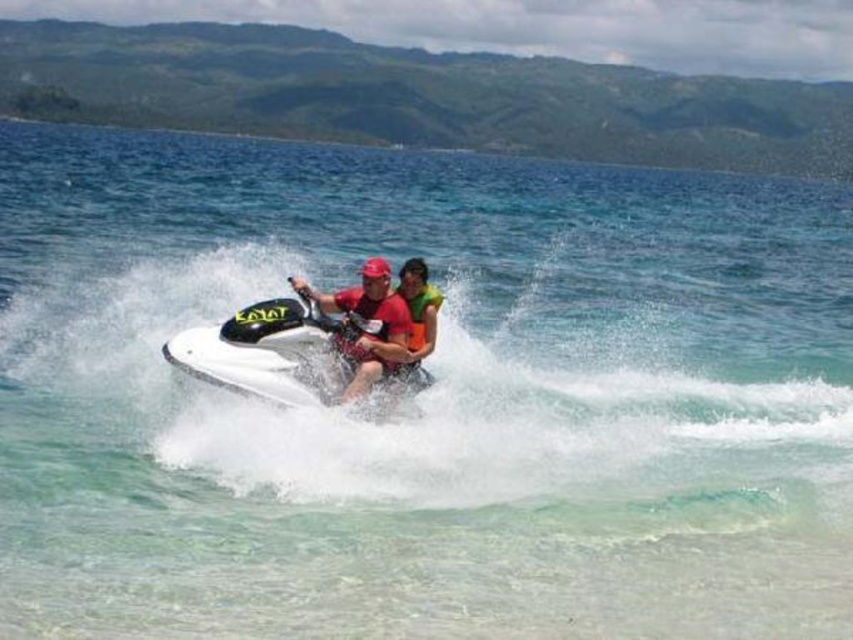
Which of these two, matte red shirt at center or green fabric life jacket at center, stands taller?

matte red shirt at center is taller.

Does matte red shirt at center lie behind green fabric life jacket at center?

No, matte red shirt at center is closer to the viewer.

Find the location of `matte red shirt at center`. matte red shirt at center is located at coordinates (366, 324).

This screenshot has width=853, height=640. I want to click on matte red shirt at center, so click(x=366, y=324).

Is matte red shirt at center to the left of orange fabric life jacket at center from the viewer's perspective?

Indeed, matte red shirt at center is positioned on the left side of orange fabric life jacket at center.

Based on the photo, who is positioned more to the left, matte red shirt at center or orange fabric life jacket at center?

Positioned to the left is matte red shirt at center.

Which is behind, point (386, 320) or point (428, 330)?

The point (428, 330) is behind.

The width and height of the screenshot is (853, 640). What are the coordinates of `matte red shirt at center` in the screenshot? It's located at (366, 324).

The image size is (853, 640). What do you see at coordinates (376, 320) in the screenshot?
I see `green fabric life jacket at center` at bounding box center [376, 320].

Who is more forward, (409, 321) or (428, 340)?

Positioned in front is point (409, 321).

Identify the location of green fabric life jacket at center. (376, 320).